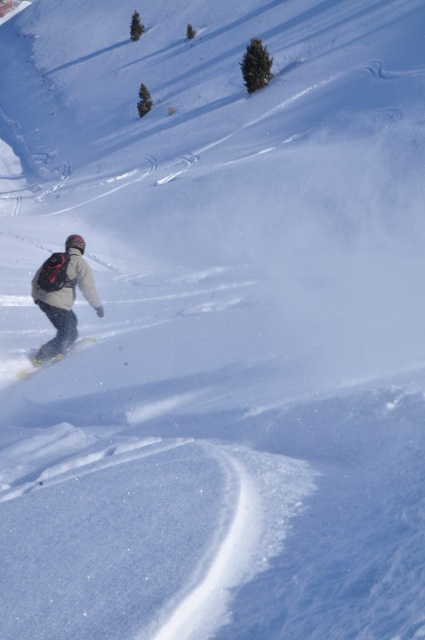
Question: Which point is closer to the camera?

Choices:
 (A) white matte snowboard at lower left
 (B) matte black snowboarder at lower left

Answer: (B)

Question: Can you confirm if matte black snowboarder at lower left is positioned above white matte snowboard at lower left?

Choices:
 (A) yes
 (B) no

Answer: (A)

Question: Does matte black snowboarder at lower left have a smaller size compared to white matte snowboard at lower left?

Choices:
 (A) yes
 (B) no

Answer: (B)

Question: Is the position of matte black snowboarder at lower left less distant than that of white matte snowboard at lower left?

Choices:
 (A) yes
 (B) no

Answer: (A)

Question: Which point is closer to the camera?

Choices:
 (A) (51, 288)
 (B) (84, 340)

Answer: (A)